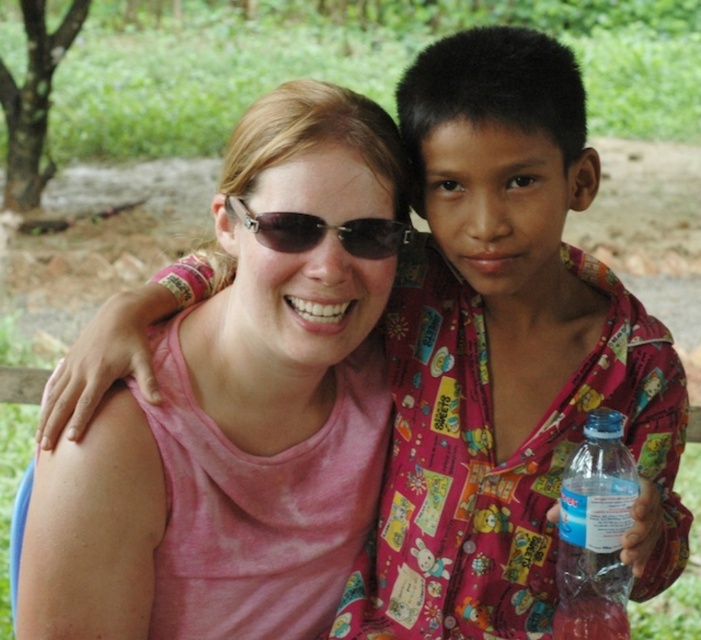
Is clear plastic bottle at lower right closer to camera compared to matte black sunglasses at center?

Yes.

Is clear plastic bottle at lower right smaller than matte black sunglasses at center?

Actually, clear plastic bottle at lower right might be larger than matte black sunglasses at center.

This screenshot has width=701, height=640. Find the location of `clear plastic bottle at lower right`. clear plastic bottle at lower right is located at coordinates (594, 532).